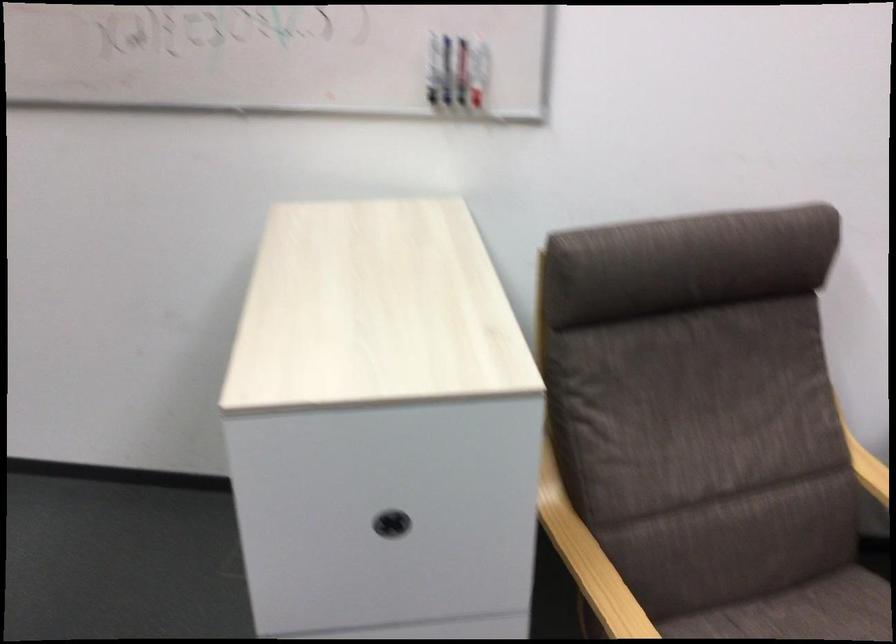
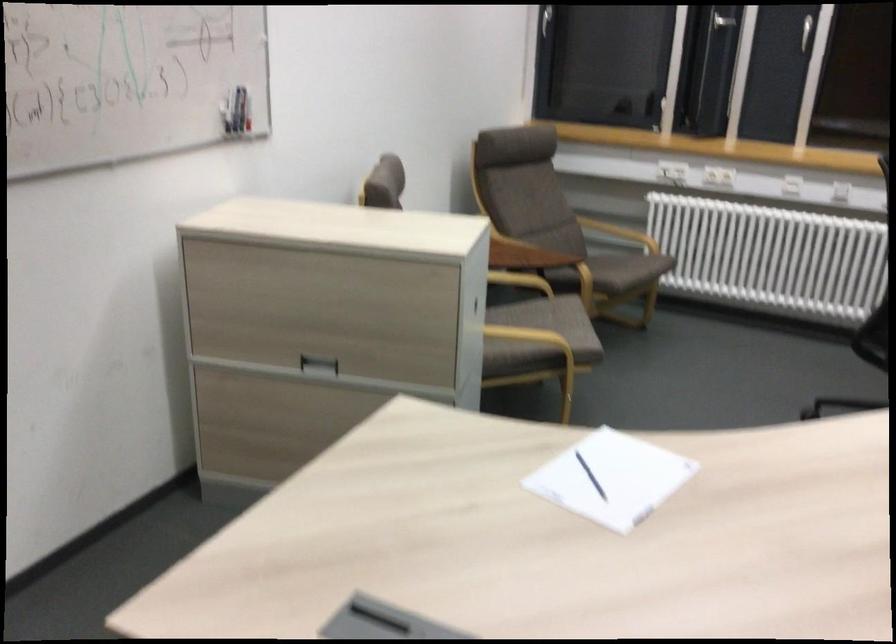
Question: I am providing you with two images of the same scene from different viewpoints. Please identify which objects are invisible in image2.

Choices:
 (A) chair sitting surface
 (B) outlet test button
 (C) blue whiteboard marker
 (D) red whiteboard marker

Answer: (A)